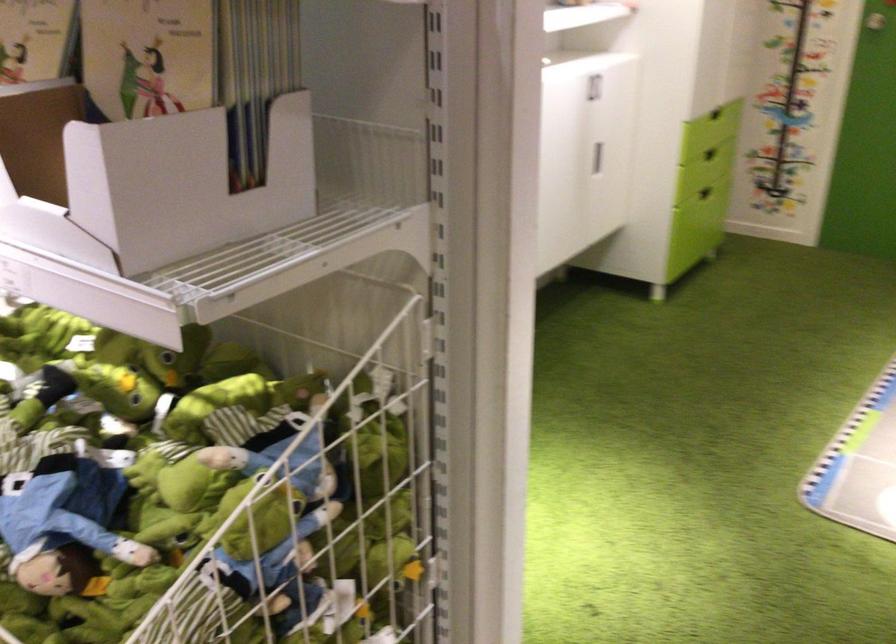
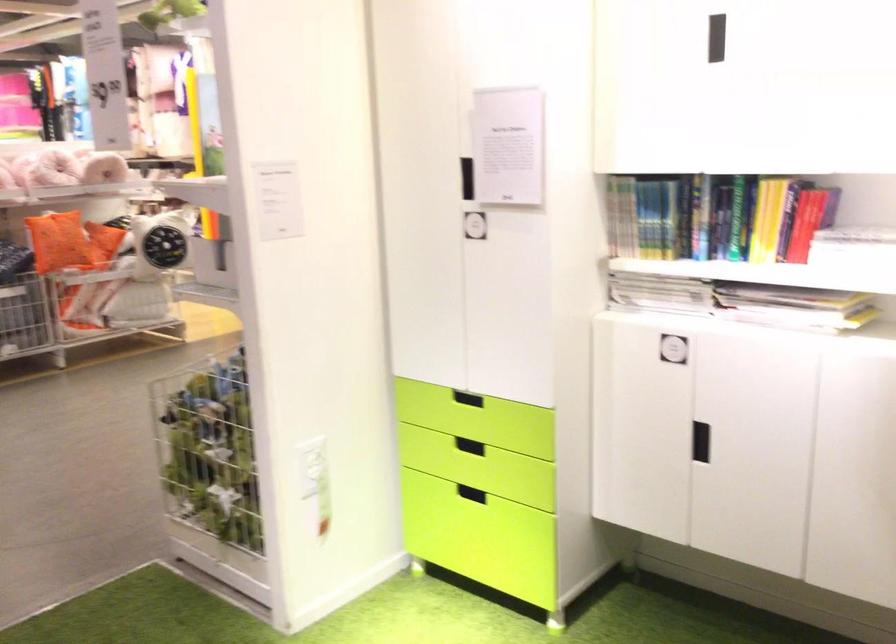
Question: I am providing you with two images of the same scene from different viewpoints. Which of the following objects are not visible in image2?

Choices:
 (A) orange square pillow
 (B) recessed black handle
 (C) thin book
 (D) clear wall hook

Answer: (C)